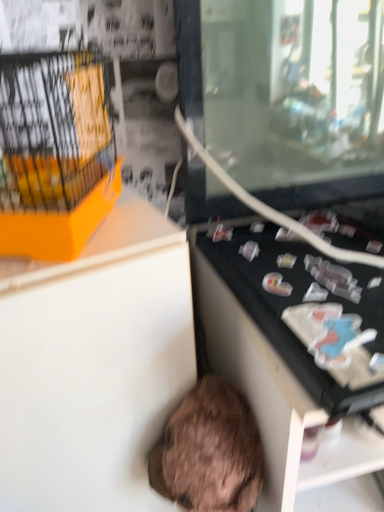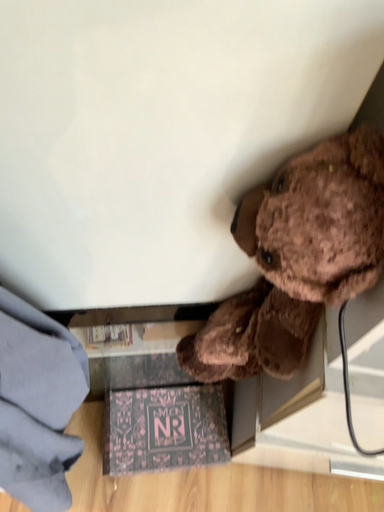
Question: How did the camera likely rotate when shooting the video?

Choices:
 (A) rotated downward
 (B) rotated upward

Answer: (A)